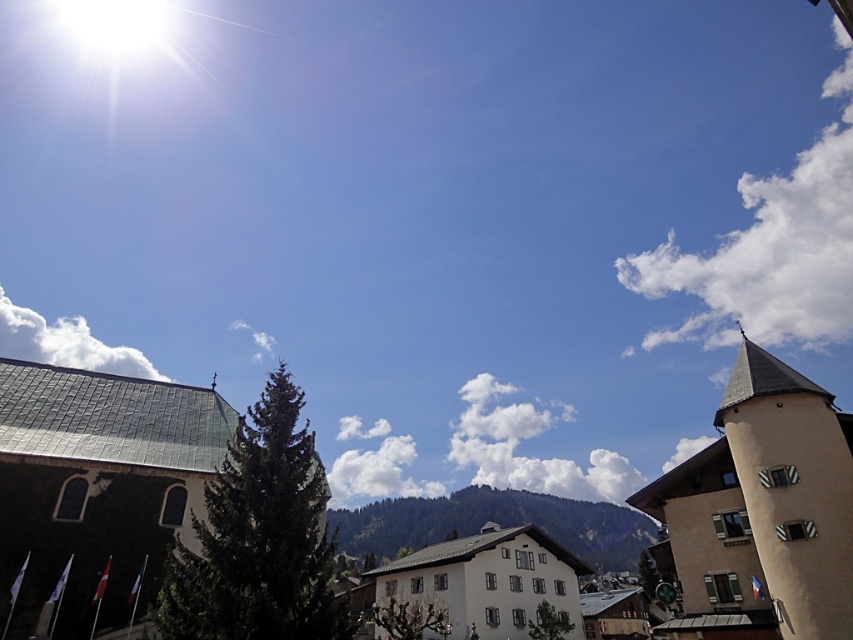
Question: Observing the image, what is the correct spatial positioning of white fluffy cloud at upper right in reference to white fluffy cloud at upper left?

Choices:
 (A) above
 (B) below

Answer: (A)

Question: Which point is farther from the camera taking this photo?

Choices:
 (A) pos(132,355)
 (B) pos(457,525)
 (C) pos(381,486)
 (D) pos(233,323)

Answer: (A)

Question: Is white fluffy cloud at center bigger than white fluffy cloud at upper center?

Choices:
 (A) yes
 (B) no

Answer: (A)

Question: Does smooth stone building at center have a smaller size compared to white fluffy cloud at upper right?

Choices:
 (A) yes
 (B) no

Answer: (A)

Question: Estimate the real-world distances between objects in this image. Which object is farther from the green grassy hill at center?

Choices:
 (A) white fluffy cloud at upper right
 (B) smooth stone building at center

Answer: (A)

Question: Which of these objects is positioned farthest from the green grassy hill at center?

Choices:
 (A) white fluffy cloud at upper left
 (B) white fluffy cloud at upper right
 (C) beige stone tower at right
 (D) smooth stone building at center

Answer: (A)